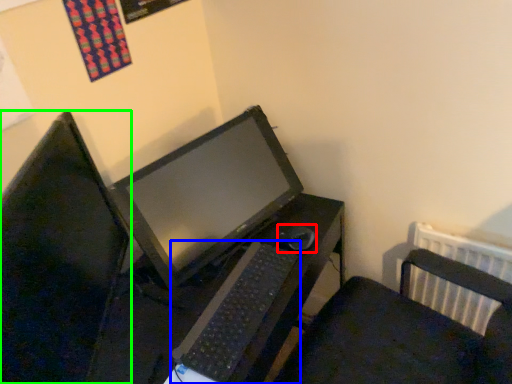
Question: Which object is the farthest from mouse (highlighted by a red box)? Choose among these: computer keyboard (highlighted by a blue box) or computer monitor (highlighted by a green box).

Choices:
 (A) computer keyboard
 (B) computer monitor

Answer: (B)